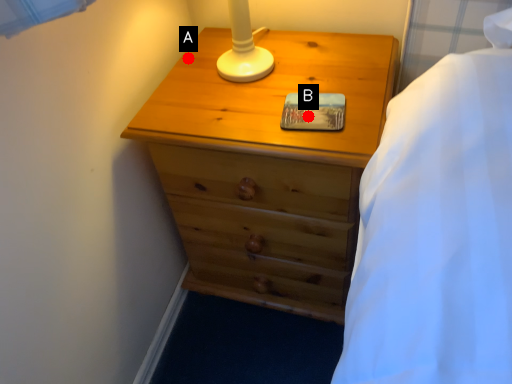
Question: Two points are circled on the image, labeled by A and B beside each circle. Which point is closer to the camera?

Choices:
 (A) A is closer
 (B) B is closer

Answer: (B)